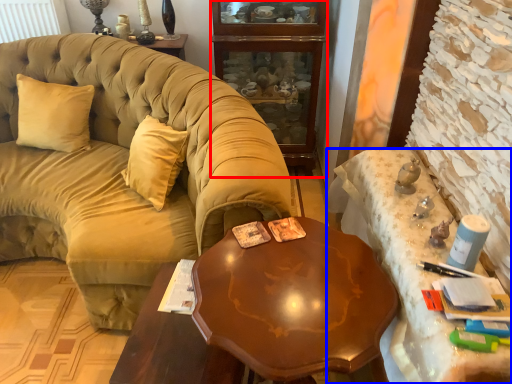
Question: Among these objects, which one is farthest to the camera, cabinetry (highlighted by a red box) or desk (highlighted by a blue box)?

Choices:
 (A) cabinetry
 (B) desk

Answer: (A)